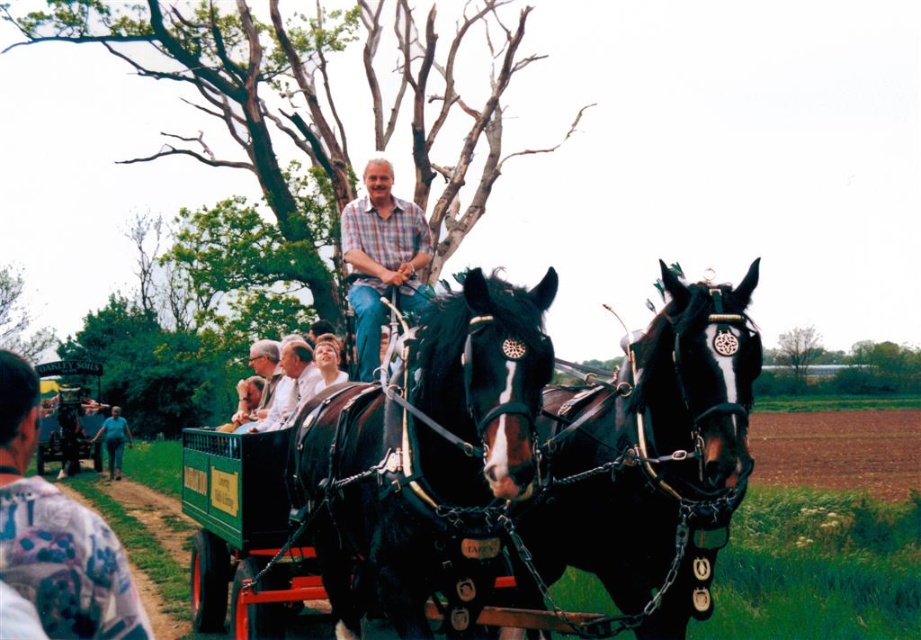
Is shiny black horse at center bigger than plaid shirt at center?

Correct, shiny black horse at center is larger in size than plaid shirt at center.

Between shiny black horse at center and plaid shirt at center, which one has less height?

plaid shirt at center is shorter.

Is point (370, 541) positioned in front of point (422, 304)?

Yes, point (370, 541) is in front of point (422, 304).

What are the coordinates of `shiny black horse at center` in the screenshot? It's located at (422, 449).

Which of these two, shiny black horse at center or green wooden cart at center, stands taller?

green wooden cart at center

Is shiny black horse at center further to the viewer compared to green wooden cart at center?

No, it is in front of green wooden cart at center.

The width and height of the screenshot is (921, 640). Find the location of `shiny black horse at center`. shiny black horse at center is located at coordinates point(422,449).

The height and width of the screenshot is (640, 921). What do you see at coordinates (422, 449) in the screenshot? I see `shiny black horse at center` at bounding box center [422, 449].

Does shiny black horse at center lie behind black leather harness at center?

That is False.

Locate an element on the screen. shiny black horse at center is located at coordinates (422, 449).